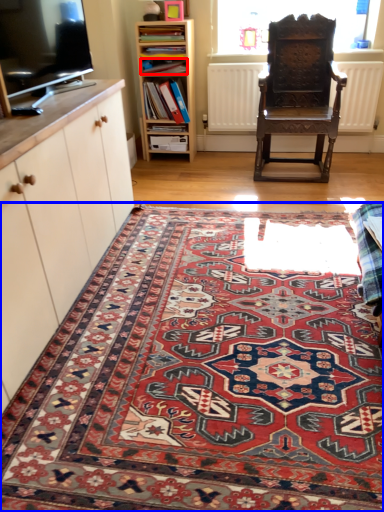
Question: Which object appears closest to the camera in this image, book (highlighted by a red box) or mat (highlighted by a blue box)?

Choices:
 (A) book
 (B) mat

Answer: (B)